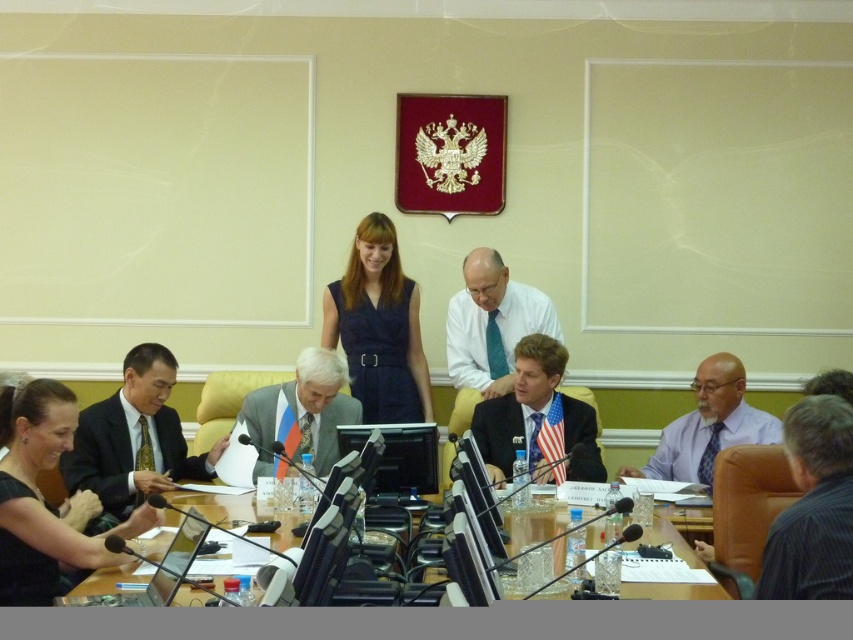
Question: Which point is closer to the camera?

Choices:
 (A) (401, 417)
 (B) (498, 460)
 (C) (798, 406)
 (D) (474, 353)

Answer: (C)

Question: Is white shirt at center wider than gray suit at center?

Choices:
 (A) yes
 (B) no

Answer: (B)

Question: Which object is closer to the camera taking this photo?

Choices:
 (A) wooden table at center
 (B) white shirt at center
 (C) striped shirt at lower right

Answer: (C)

Question: Is black dress at lower left thinner than white shirt at center?

Choices:
 (A) no
 (B) yes

Answer: (B)

Question: Can you confirm if dark blue dress at center is positioned below gray suit at center?

Choices:
 (A) no
 (B) yes

Answer: (A)

Question: Which point is closer to the camera?

Choices:
 (A) dark suit at center
 (B) white shirt at center
 (C) blue suit at center
 (D) wooden table at center

Answer: (D)